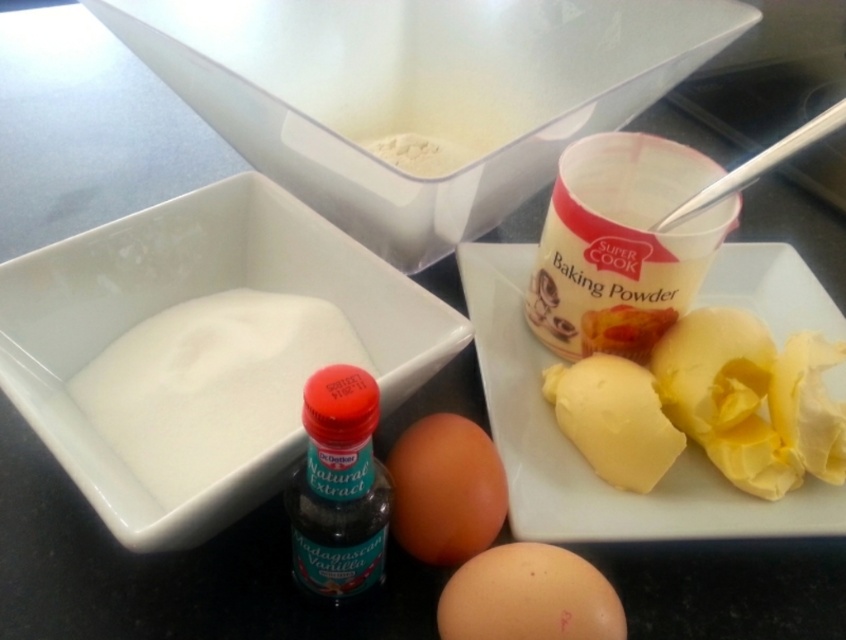
Question: Which object is positioned farthest from the brown matte egg at lower center?

Choices:
 (A) orange matte egg at center
 (B) black glass bottle at center

Answer: (B)

Question: Which point is farther from the camera taking this photo?

Choices:
 (A) (806, 381)
 (B) (141, 416)
 (C) (411, 486)

Answer: (A)

Question: Is white powder at left wider than black glass bottle at center?

Choices:
 (A) no
 (B) yes

Answer: (B)

Question: Which point is farther to the camera?

Choices:
 (A) white powder at left
 (B) black glass bottle at center
 (C) brown matte egg at lower center

Answer: (A)

Question: Can you confirm if yellow creamy butter at right is smaller than orange matte egg at center?

Choices:
 (A) yes
 (B) no

Answer: (B)

Question: Is yellow creamy butter at right bigger than white powder at left?

Choices:
 (A) yes
 (B) no

Answer: (B)